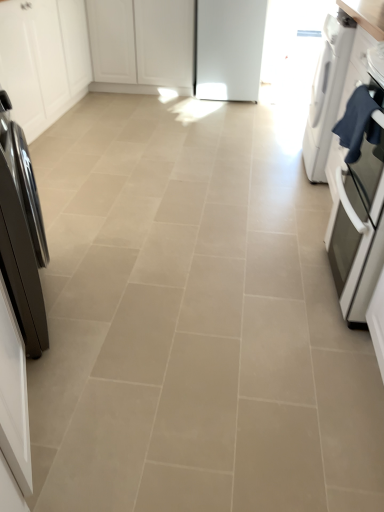
Identify the location of free space to the left of white glossy dryer at right, positioned as the 1th home appliance in right-to-left order. point(261,165).